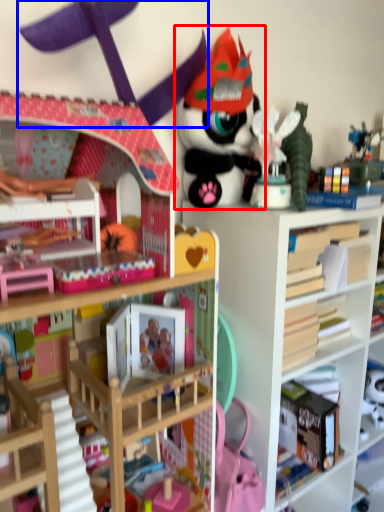
Question: Which object is further to the camera taking this photo, toy (highlighted by a red box) or toy (highlighted by a blue box)?

Choices:
 (A) toy
 (B) toy

Answer: (A)